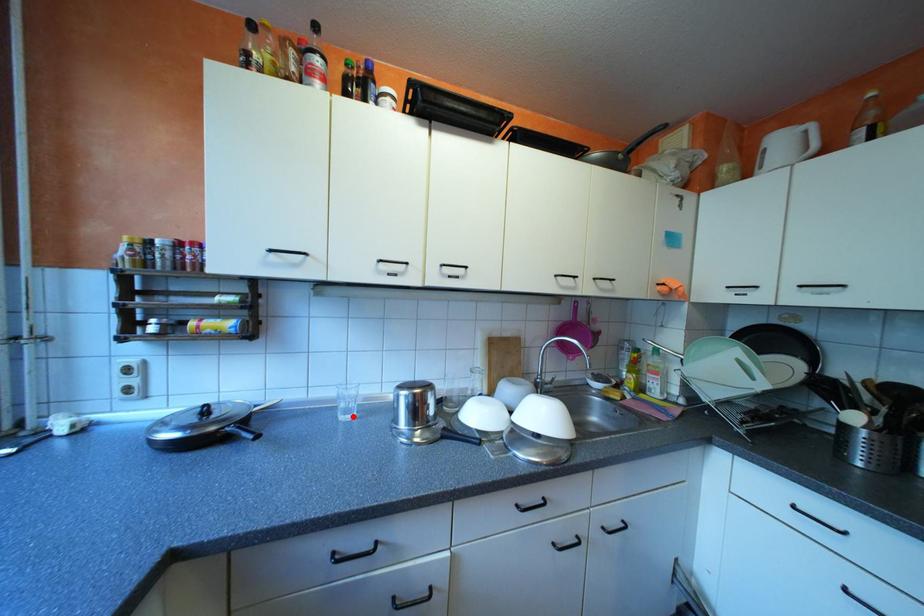
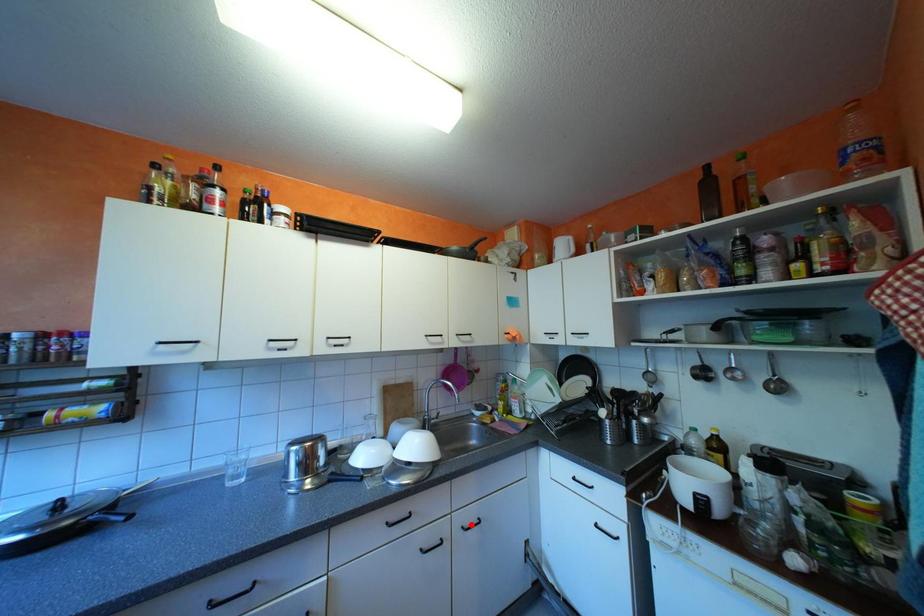
I am providing you with two images of the same scene from different viewpoints. A red point is marked on the first image and another point is marked on the second image. Is the red point in image1 aligned with the point shown in image2?

No